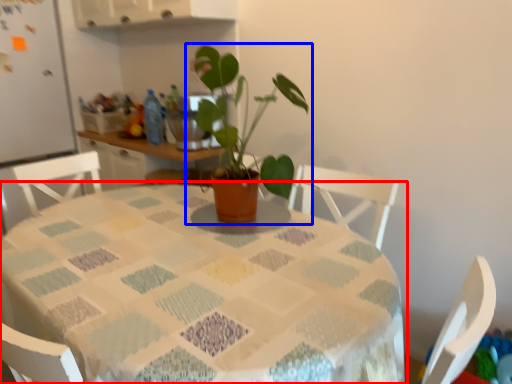
Question: Which of the following is the closest to the observer, table (highlighted by a red box) or houseplant (highlighted by a blue box)?

Choices:
 (A) table
 (B) houseplant

Answer: (A)